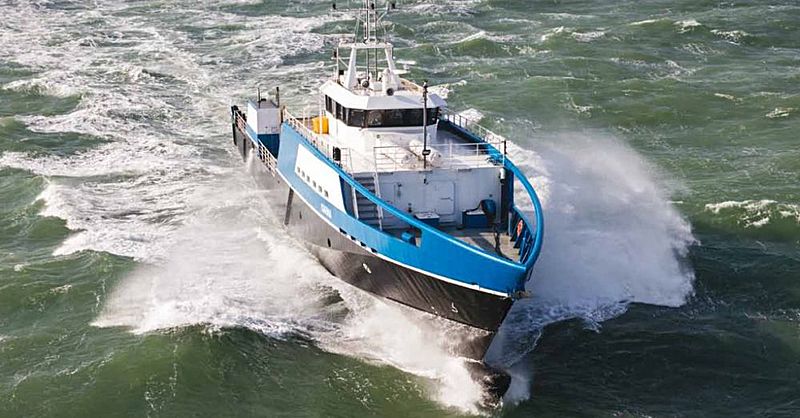
The width and height of the screenshot is (800, 418). Identify the location of ladder. (370, 58).